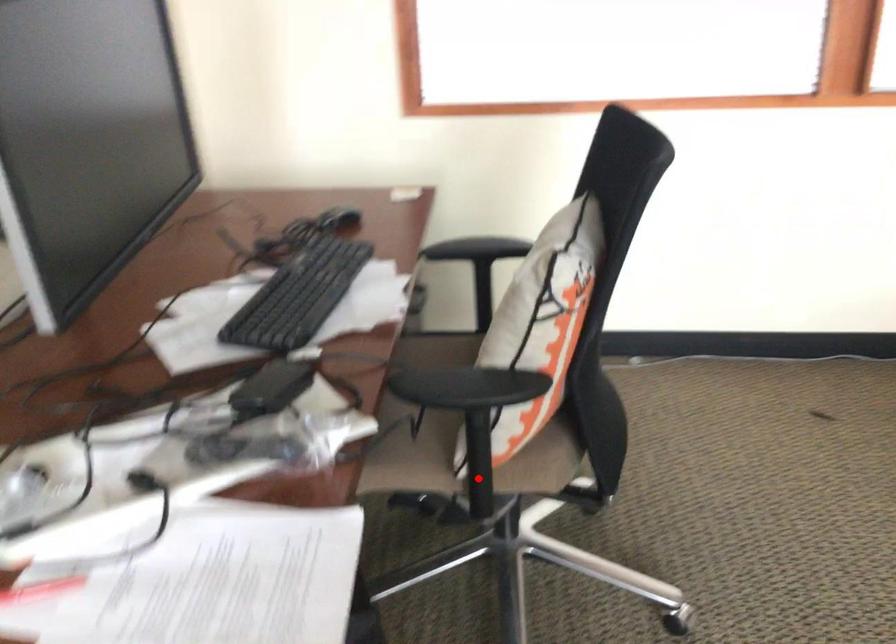
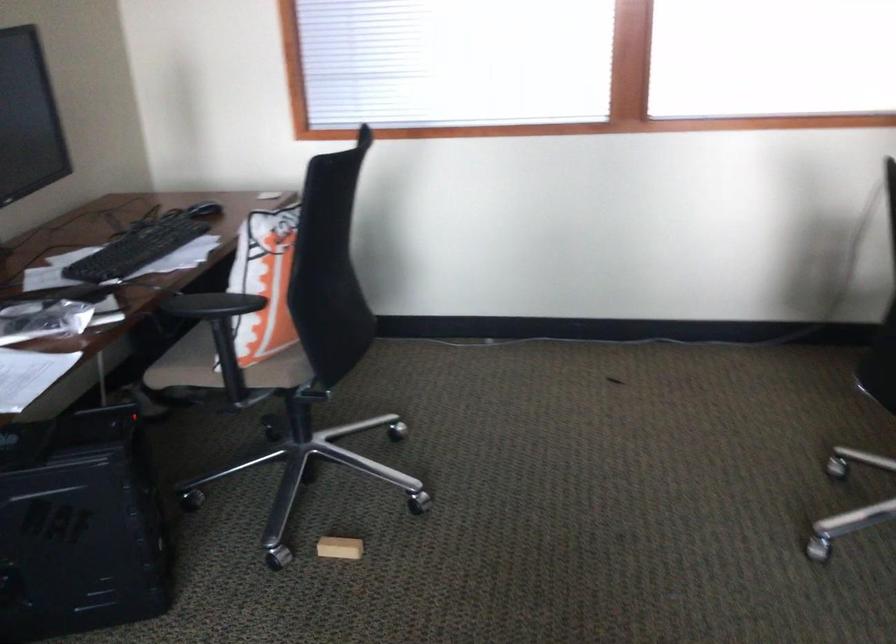
Question: I am providing you with two images of the same scene from different viewpoints. Given a red point in image1, look at the same physical point in image2. Is it:

Choices:
 (A) Closer to the viewpoint
 (B) Farther from the viewpoint

Answer: (B)